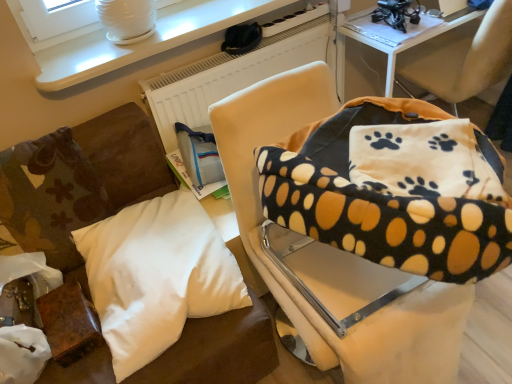
Question: Should I look upward or downward to see white matte radiator at upper center?

Choices:
 (A) down
 (B) up

Answer: (B)

Question: Is soft beige chair at center, placed as the 2th chair when sorted from right to left, smaller than white soft pillow at lower left, the second pillow in the left-to-right sequence?

Choices:
 (A) yes
 (B) no

Answer: (B)

Question: Is white soft pillow at lower left, the second pillow in the left-to-right sequence, a part of soft beige chair at center, placed as the 2th chair when sorted from right to left?

Choices:
 (A) yes
 (B) no

Answer: (B)

Question: Can you confirm if soft beige chair at center, acting as the 1th chair starting from the left, is shorter than white soft pillow at lower left, acting as the 2th pillow starting from the right?

Choices:
 (A) yes
 (B) no

Answer: (B)

Question: Is the surface of soft beige chair at center, placed as the 2th chair when sorted from right to left, in direct contact with white soft pillow at lower left, acting as the 2th pillow starting from the right?

Choices:
 (A) no
 (B) yes

Answer: (A)

Question: From the image's perspective, would you say soft beige chair at center, placed as the 2th chair when sorted from right to left, is shown under white soft pillow at lower left, the second pillow in the left-to-right sequence?

Choices:
 (A) no
 (B) yes

Answer: (A)

Question: Can you confirm if soft beige chair at center, acting as the 1th chair starting from the left, is bigger than white soft pillow at lower left, acting as the 2th pillow starting from the right?

Choices:
 (A) no
 (B) yes

Answer: (B)

Question: Is white soft pillow at lower left, acting as the 2th pillow starting from the right, thinner than white matte radiator at upper center?

Choices:
 (A) no
 (B) yes

Answer: (A)

Question: From a real-world perspective, is white soft pillow at lower left, the second pillow in the left-to-right sequence, located beneath white matte radiator at upper center?

Choices:
 (A) no
 (B) yes

Answer: (A)

Question: Considering the relative sizes of white soft pillow at lower left, acting as the 2th pillow starting from the right, and white matte radiator at upper center in the image provided, is white soft pillow at lower left, acting as the 2th pillow starting from the right, taller than white matte radiator at upper center?

Choices:
 (A) no
 (B) yes

Answer: (A)

Question: Considering the relative positions of white soft pillow at lower left, the second pillow in the left-to-right sequence, and white matte radiator at upper center in the image provided, is white soft pillow at lower left, the second pillow in the left-to-right sequence, to the right of white matte radiator at upper center from the viewer's perspective?

Choices:
 (A) yes
 (B) no

Answer: (B)

Question: Does white soft pillow at lower left, the second pillow in the left-to-right sequence, have a lesser height compared to white matte radiator at upper center?

Choices:
 (A) no
 (B) yes

Answer: (B)

Question: From the image's perspective, would you say white soft pillow at lower left, the third pillow positioned from the right, is shown under white matte radiator at upper center?

Choices:
 (A) no
 (B) yes

Answer: (B)